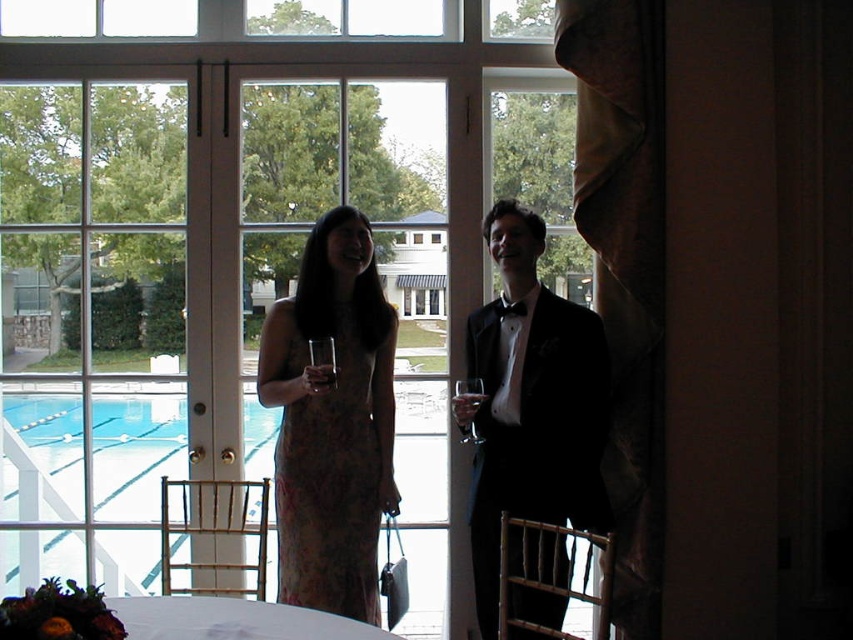
You are hosting a dinner party and want to place a decorative centerpiece between the white cloth at lower center and the clear glass wine glass at center. Based on their positions, where should you position the centerpiece to ensure it is centered between them?

Since the white cloth at lower center is to the left of the clear glass wine glass at center, the centerpiece should be placed between them, closer to the middle point between the two objects to ensure it is centered.

You are standing at the point marked by the coordinates point (241, 616) in the image. Looking around, what object is directly in front of you?

The point (241, 616) marks white cloth at lower center, so the white cloth at lower center is directly in front of you.

You are at a party and want to pour wine into one of the glasses. Which glass, the clear glass at center or the translucent glass wine at center, can hold more liquid based on their thickness?

The translucent glass wine at center can hold more liquid because it is thicker than the clear glass at center.